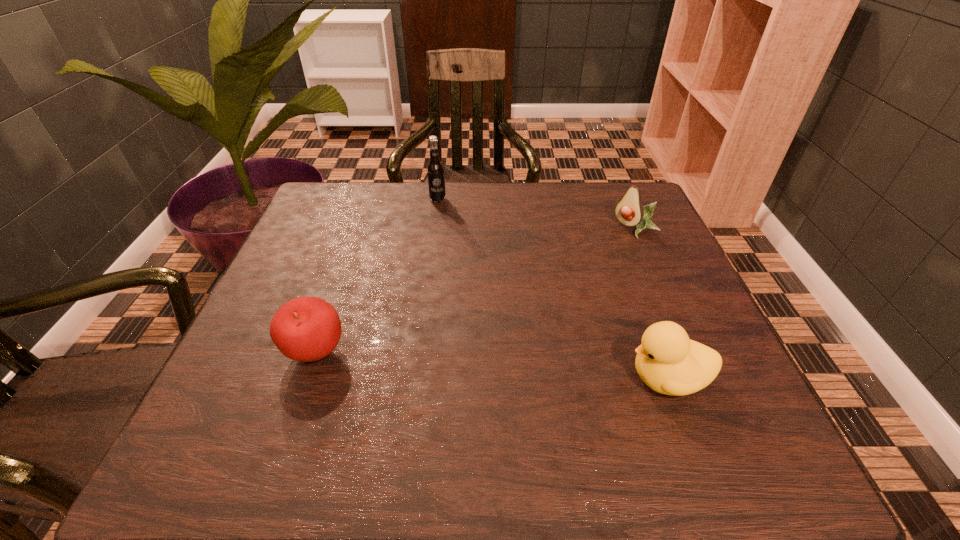
At what (x,y) coordinates should I click in order to perform the action: click on empty space that is in between the duck and the apple. Please return your answer as a coordinate pair (x, y). This screenshot has width=960, height=540. Looking at the image, I should click on tap(492, 366).

This screenshot has width=960, height=540. Identify the location of free space between the duck and the root beer. (552, 289).

Identify which object is the nearest to the third nearest object. Please provide its 2D coordinates. Your answer should be formatted as a tuple, i.e. [(x, y)], where the tuple contains the x and y coordinates of a point satisfying the conditions above.

[(667, 361)]

The image size is (960, 540). I want to click on object that is the second closest to the duck, so click(x=306, y=329).

Locate an element on the screen. free space that satisfies the following two spatial constraints: 1. on the back side of the leftmost object; 2. on the left side of the farthest object is located at coordinates (369, 199).